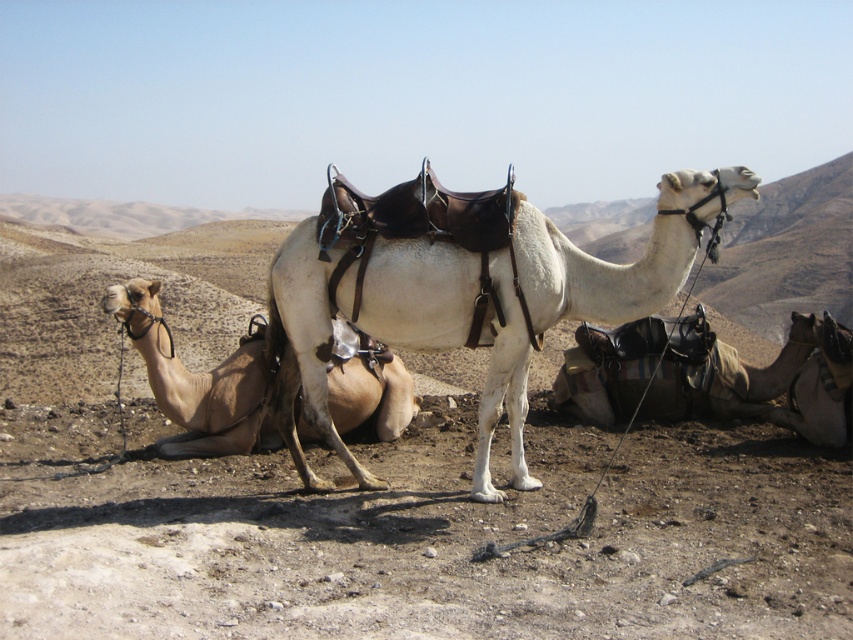
Does light brown leather camel at center lie in front of brown leather saddle at lower right?

Yes.

Which is behind, point (157, 320) or point (724, 413)?

Positioned behind is point (724, 413).

This screenshot has height=640, width=853. In order to click on light brown leather camel at center in this screenshot , I will do `click(196, 381)`.

Is dusty brown ground at center positioned before light brown leather camel at center?

That is True.

Who is lower down, dusty brown ground at center or light brown leather camel at center?

light brown leather camel at center is below.

I want to click on dusty brown ground at center, so click(437, 531).

This screenshot has width=853, height=640. I want to click on dusty brown ground at center, so click(x=437, y=531).

Which of these two, dusty brown ground at center or brown leather saddle at lower right, stands shorter?

With less height is brown leather saddle at lower right.

This screenshot has height=640, width=853. In order to click on dusty brown ground at center in this screenshot , I will do `click(437, 531)`.